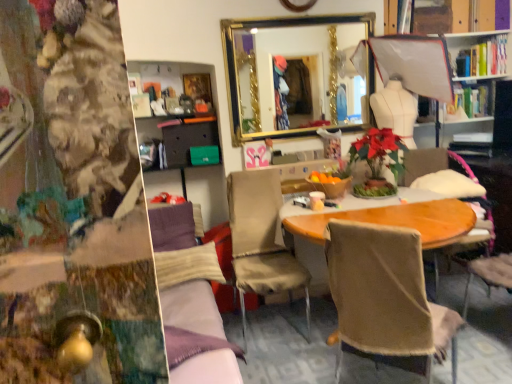
Question: Are gold-framed mirror at upper center and wooden chair at center, marked as the 1th chair in a right-to-left arrangement, beside each other?

Choices:
 (A) yes
 (B) no

Answer: (B)

Question: Can you confirm if gold-framed mirror at upper center is bigger than wooden chair at center, marked as the 1th chair in a right-to-left arrangement?

Choices:
 (A) yes
 (B) no

Answer: (B)

Question: Are gold-framed mirror at upper center and wooden chair at center, marked as the 1th chair in a right-to-left arrangement, far apart?

Choices:
 (A) yes
 (B) no

Answer: (A)

Question: Considering the relative positions of gold-framed mirror at upper center and wooden chair at center, marked as the 1th chair in a right-to-left arrangement, in the image provided, is gold-framed mirror at upper center to the left of wooden chair at center, marked as the 1th chair in a right-to-left arrangement, from the viewer's perspective?

Choices:
 (A) no
 (B) yes

Answer: (B)

Question: Does gold-framed mirror at upper center have a smaller size compared to wooden chair at center, acting as the 3th chair starting from the left?

Choices:
 (A) no
 (B) yes

Answer: (B)

Question: Considering the relative positions of gold-framed mirror at upper center and wooden chair at center, acting as the 3th chair starting from the left, in the image provided, is gold-framed mirror at upper center to the right of wooden chair at center, acting as the 3th chair starting from the left, from the viewer's perspective?

Choices:
 (A) no
 (B) yes

Answer: (A)

Question: Is beige fabric chair at center, which is the third chair in right-to-left order, thinner than velvet purple couch at center?

Choices:
 (A) no
 (B) yes

Answer: (A)

Question: Is velvet purple couch at center inside beige fabric chair at center, which is the third chair in right-to-left order?

Choices:
 (A) no
 (B) yes

Answer: (A)

Question: Is beige fabric chair at center, the first chair when ordered from left to right, oriented towards velvet purple couch at center?

Choices:
 (A) no
 (B) yes

Answer: (A)

Question: Considering the relative positions of beige fabric chair at center, the first chair when ordered from left to right, and velvet purple couch at center in the image provided, is beige fabric chair at center, the first chair when ordered from left to right, to the left of velvet purple couch at center from the viewer's perspective?

Choices:
 (A) yes
 (B) no

Answer: (B)

Question: Is beige fabric chair at center, the first chair when ordered from left to right, smaller than velvet purple couch at center?

Choices:
 (A) no
 (B) yes

Answer: (B)

Question: Is beige fabric chair at center, the first chair when ordered from left to right, in front of velvet purple couch at center?

Choices:
 (A) yes
 (B) no

Answer: (B)

Question: Does matte gray drawer at center-left turn towards hardcover books at upper right?

Choices:
 (A) yes
 (B) no

Answer: (B)